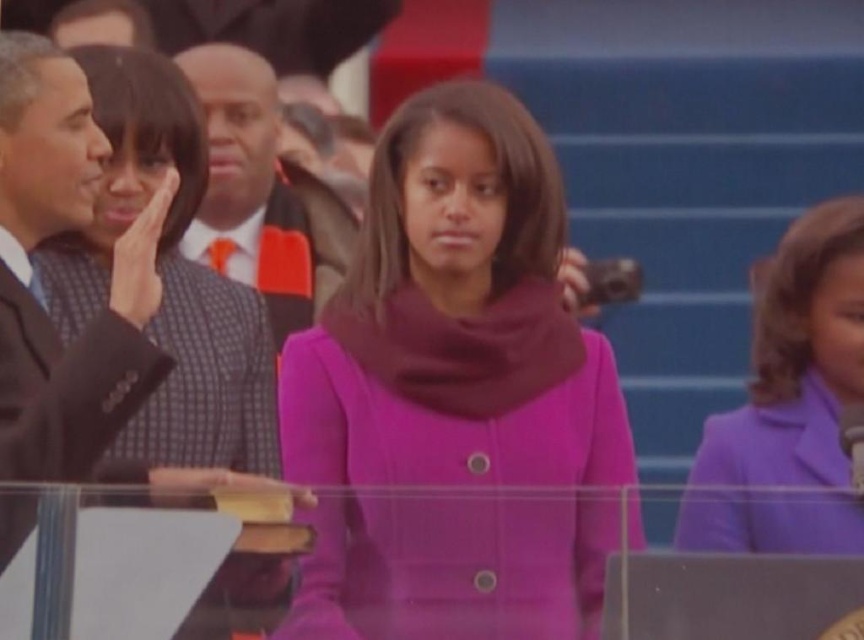
Question: Can you confirm if dark suit at left is smaller than orange textured tie at center?

Choices:
 (A) no
 (B) yes

Answer: (A)

Question: Which point is farther to the camera?

Choices:
 (A) dark suit at left
 (B) matte black suit at left

Answer: (A)

Question: Can you confirm if matte purple coat at center is bigger than orange textured tie at center?

Choices:
 (A) no
 (B) yes

Answer: (B)

Question: Is dark suit at left positioned in front of orange textured tie at center?

Choices:
 (A) yes
 (B) no

Answer: (A)

Question: Among these points, which one is farthest from the camera?

Choices:
 (A) (227, 582)
 (B) (842, 392)

Answer: (B)

Question: Based on their relative distances, which object is farther from the dark suit at left?

Choices:
 (A) purple matte blazer at right
 (B) matte black suit at left

Answer: (A)